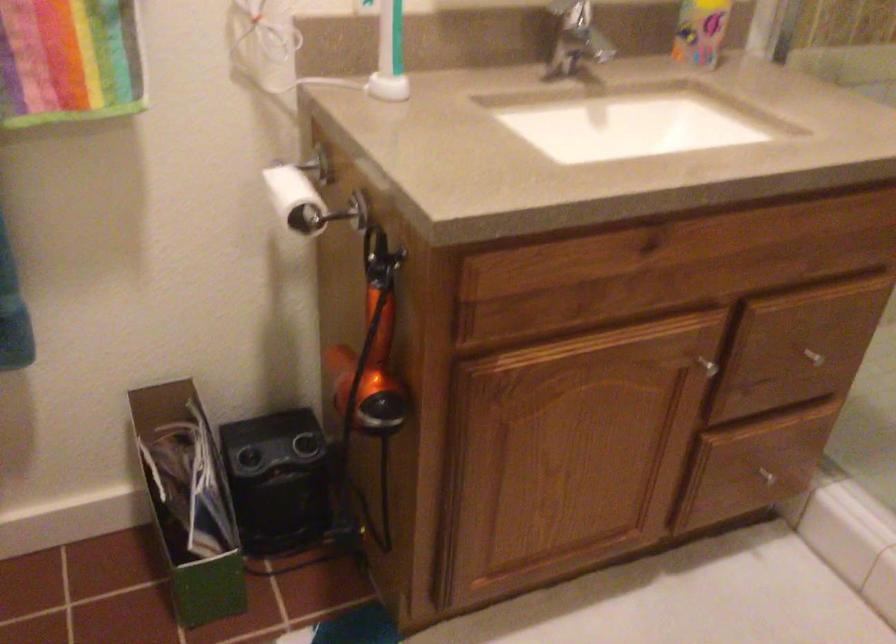
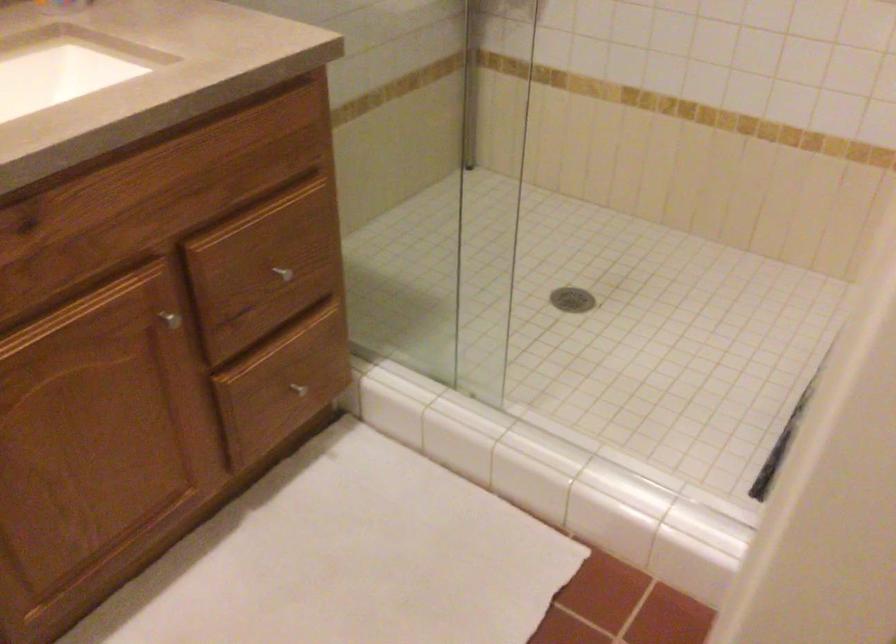
Find the pixel in the second image that matches point (702, 364) in the first image.

(169, 319)